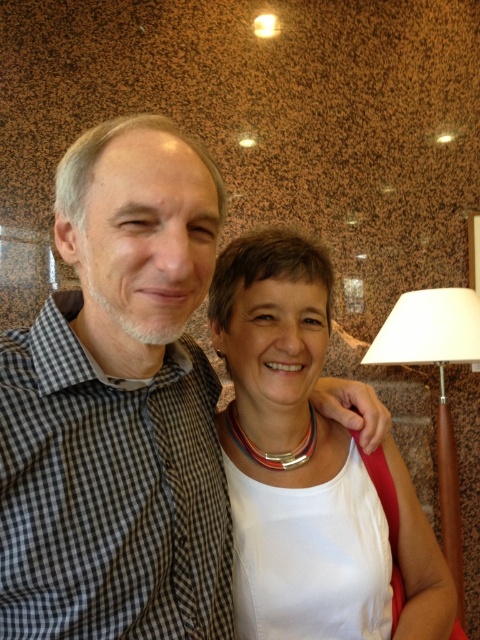
Can you confirm if white matte necklace at center is positioned above wooden base lampshade at right?

Indeed, white matte necklace at center is positioned over wooden base lampshade at right.

Which is behind, point (308, 532) or point (445, 300)?

The point (445, 300) is more distant.

Describe the element at coordinates (292, 452) in the screenshot. I see `white matte necklace at center` at that location.

Identify the location of white matte necklace at center. Image resolution: width=480 pixels, height=640 pixels. (292, 452).

Between checkered fabric shirt at center and white matte necklace at center, which one has more height?

white matte necklace at center is taller.

You are a GUI agent. You are given a task and a screenshot of the screen. Output one action in this format:
    pyautogui.click(x=<x>, y=<y>)
    Task: Click on the checkered fabric shirt at center
    
    Given the screenshot: What is the action you would take?
    pyautogui.click(x=119, y=406)

Identify the location of checkered fabric shirt at center. [x=119, y=406].

Locate an element on the screen. The height and width of the screenshot is (640, 480). checkered fabric shirt at center is located at coordinates pyautogui.click(x=119, y=406).

What are the coordinates of `checkered fabric shirt at center` in the screenshot? It's located at (119, 406).

The height and width of the screenshot is (640, 480). I want to click on checkered fabric shirt at center, so click(119, 406).

In order to click on checkered fabric shirt at center in this screenshot , I will do `click(119, 406)`.